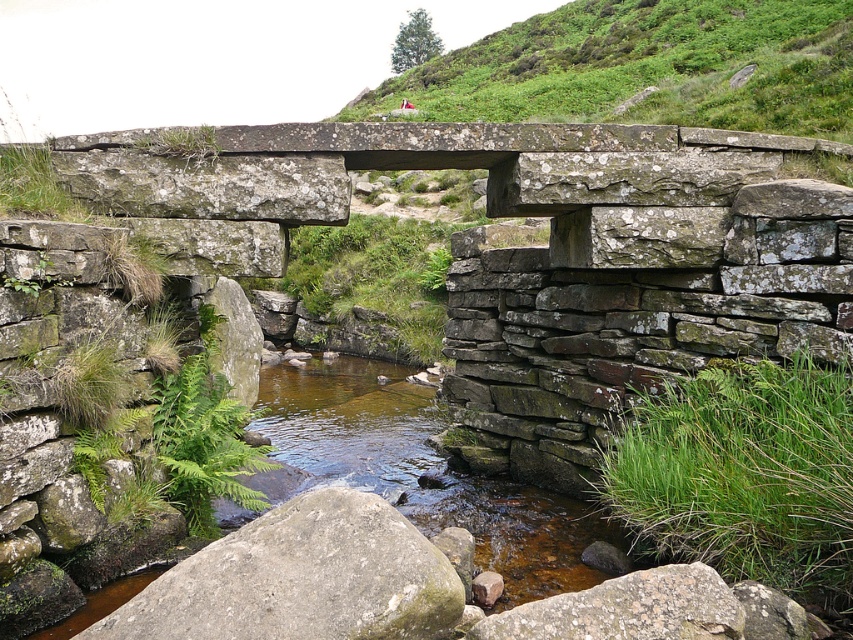
Question: Among these points, which one is nearest to the camera?

Choices:
 (A) (762, 52)
 (B) (280, 579)

Answer: (B)

Question: Is the position of green grassy hillside at upper center more distant than that of gray rough rock at center?

Choices:
 (A) yes
 (B) no

Answer: (A)

Question: Does green grassy hillside at upper center have a greater width compared to gray rough rock at center?

Choices:
 (A) yes
 (B) no

Answer: (A)

Question: Which point is closer to the camera taking this photo?

Choices:
 (A) (531, 17)
 (B) (323, 584)

Answer: (B)

Question: Which of the following is the closest to the observer?

Choices:
 (A) (656, 120)
 (B) (328, 544)

Answer: (B)

Question: Is green grassy hillside at upper center above gray rough rock at center?

Choices:
 (A) no
 (B) yes

Answer: (B)